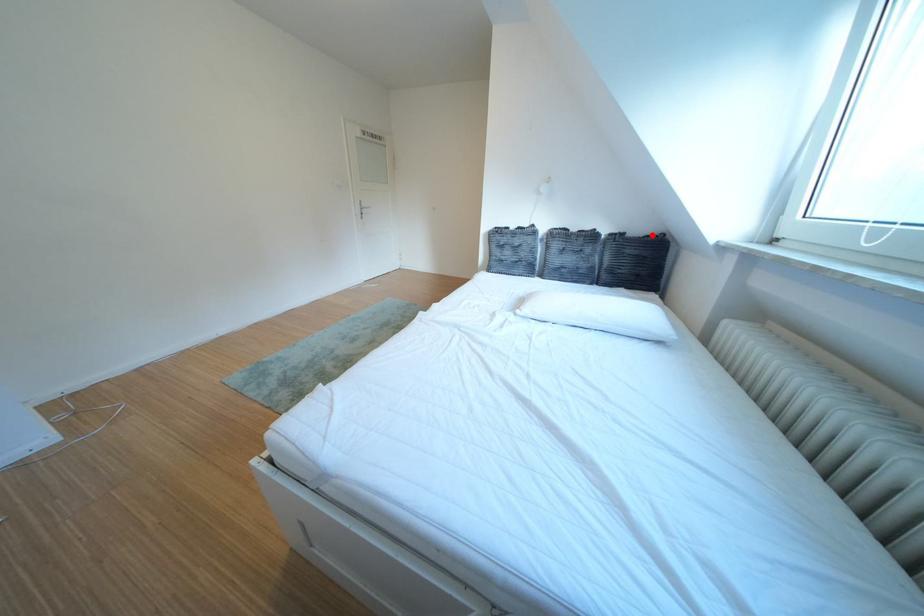
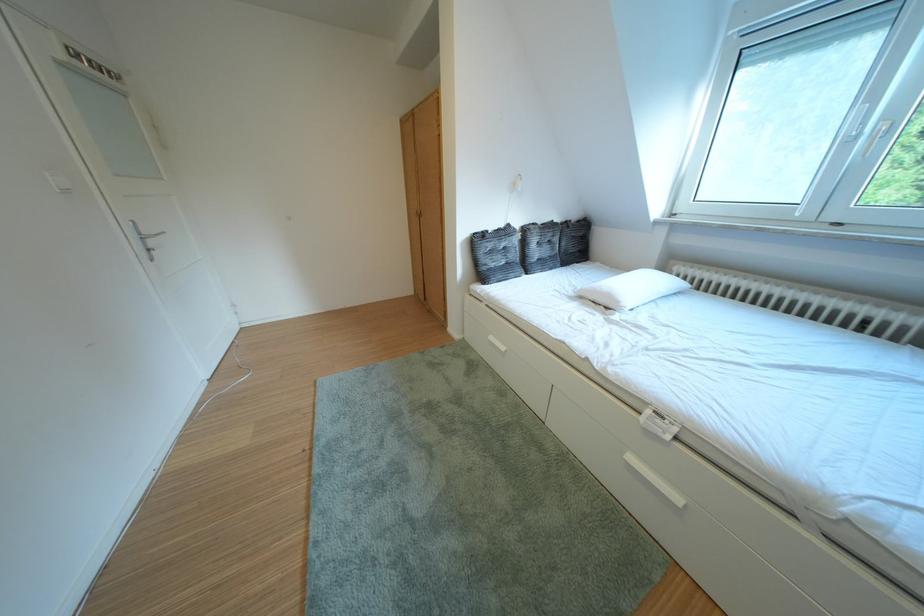
Where in the second image is the point corresponding to the highlighted location from the first image?

(588, 222)